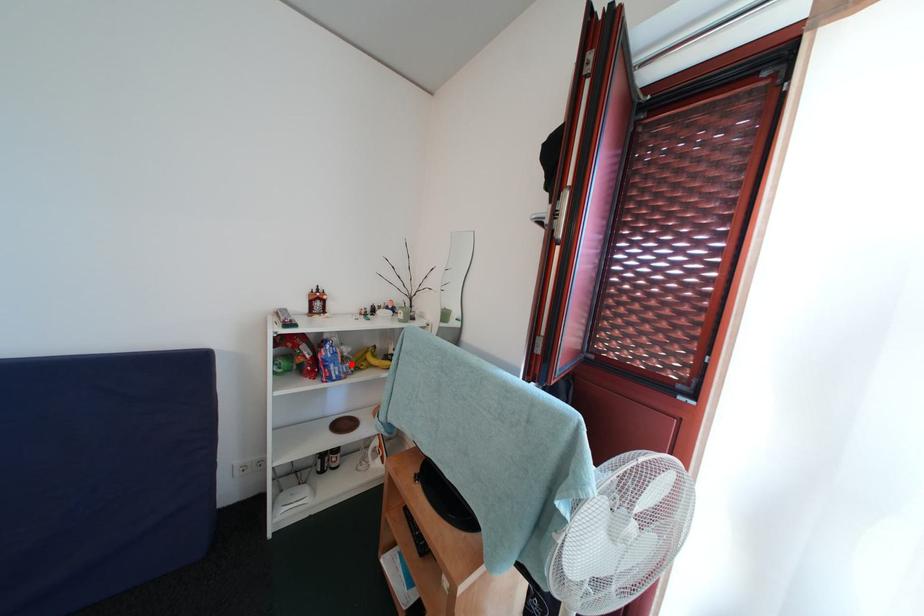
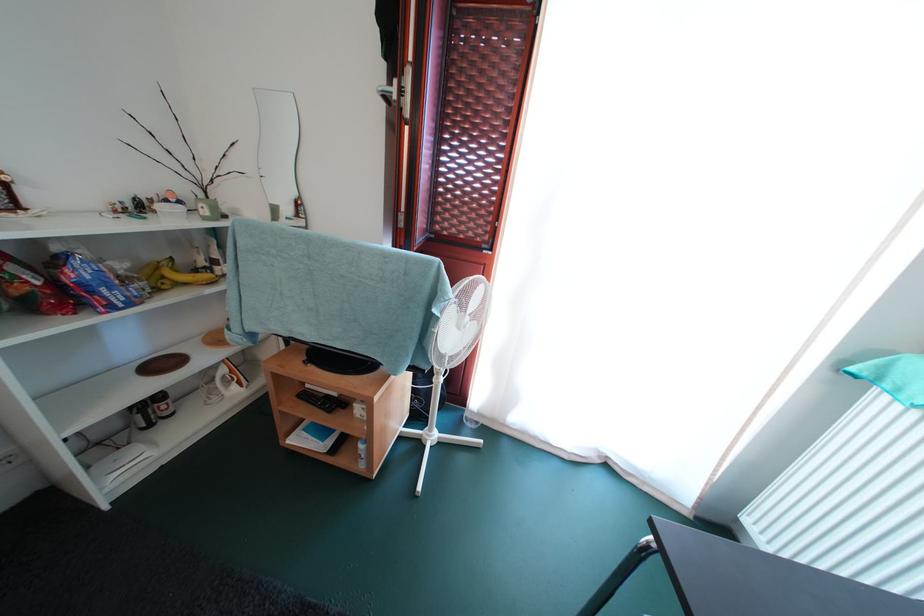
Find the pixel in the second image that matches the highlighted location in the first image.

(131, 285)